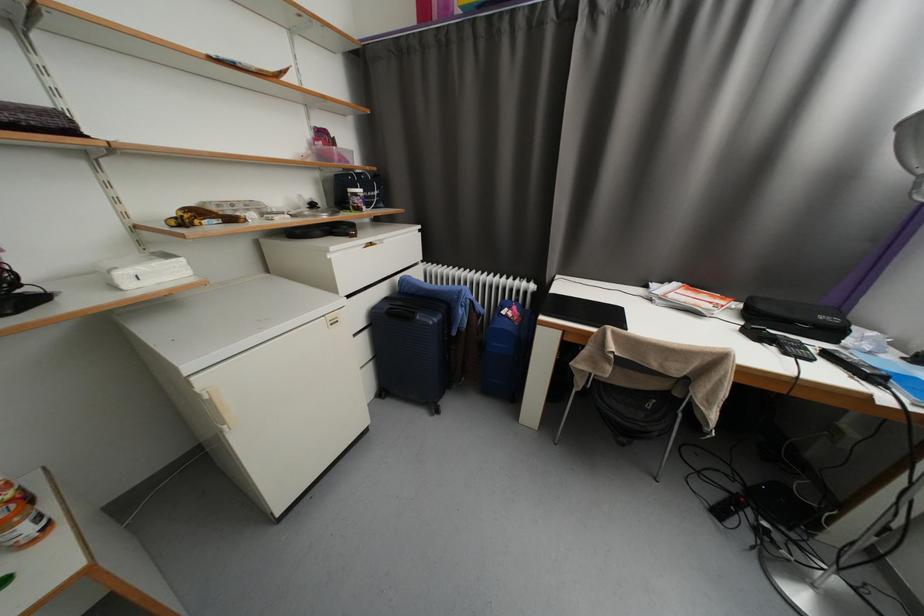
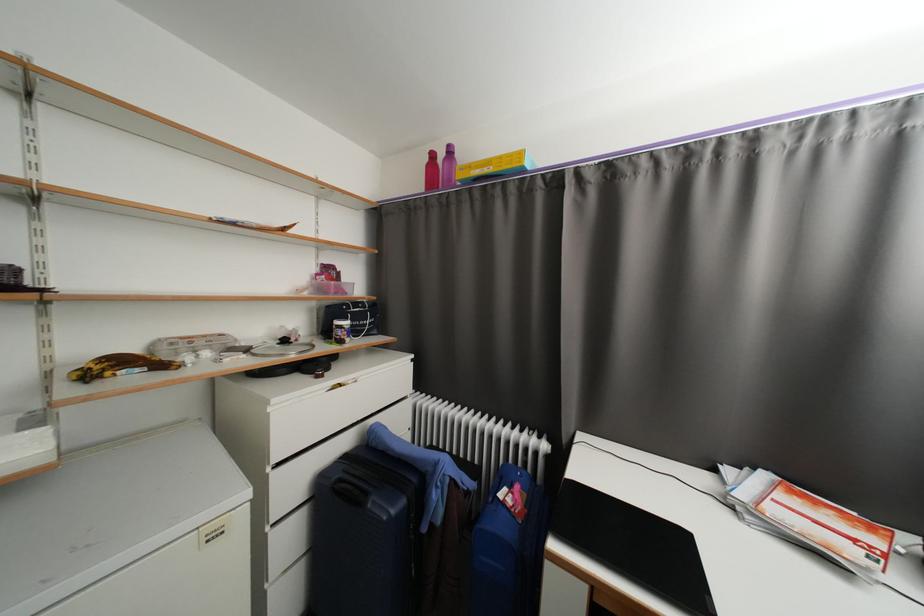
Locate, in the second image, the point that corresponds to [367,192] in the first image.

(353, 323)